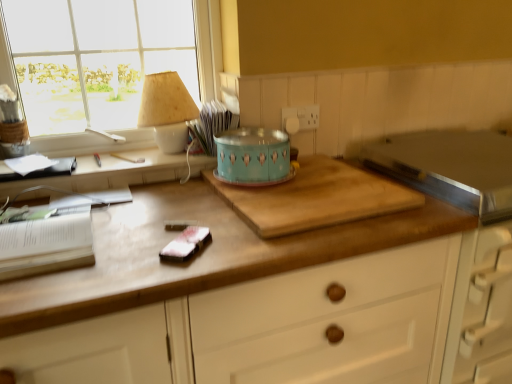
Question: Can you see wooden desk at lower left touching wooden cutting board at center?

Choices:
 (A) no
 (B) yes

Answer: (A)

Question: Is wooden desk at lower left at the left side of wooden cutting board at center?

Choices:
 (A) no
 (B) yes

Answer: (B)

Question: From the image's perspective, is wooden desk at lower left below wooden cutting board at center?

Choices:
 (A) no
 (B) yes

Answer: (A)

Question: Is wooden desk at lower left shorter than wooden cutting board at center?

Choices:
 (A) no
 (B) yes

Answer: (B)

Question: Does wooden desk at lower left have a smaller size compared to wooden cutting board at center?

Choices:
 (A) yes
 (B) no

Answer: (A)

Question: From the image's perspective, is wooden desk at lower left located above wooden cutting board at center?

Choices:
 (A) no
 (B) yes

Answer: (B)

Question: Considering the relative sizes of satin pink fabric at center and wooden cutting board at center in the image provided, is satin pink fabric at center taller than wooden cutting board at center?

Choices:
 (A) yes
 (B) no

Answer: (B)

Question: Is satin pink fabric at center in front of wooden cutting board at center?

Choices:
 (A) yes
 (B) no

Answer: (B)

Question: Considering the relative positions of satin pink fabric at center and wooden cutting board at center in the image provided, is satin pink fabric at center to the right of wooden cutting board at center from the viewer's perspective?

Choices:
 (A) yes
 (B) no

Answer: (B)

Question: Is satin pink fabric at center further to camera compared to wooden cutting board at center?

Choices:
 (A) no
 (B) yes

Answer: (B)

Question: Is satin pink fabric at center positioned with its back to wooden cutting board at center?

Choices:
 (A) no
 (B) yes

Answer: (A)

Question: Can you confirm if satin pink fabric at center is bigger than wooden cutting board at center?

Choices:
 (A) yes
 (B) no

Answer: (B)

Question: Is wooden cutting board at center facing away from satin pink fabric at center?

Choices:
 (A) no
 (B) yes

Answer: (A)